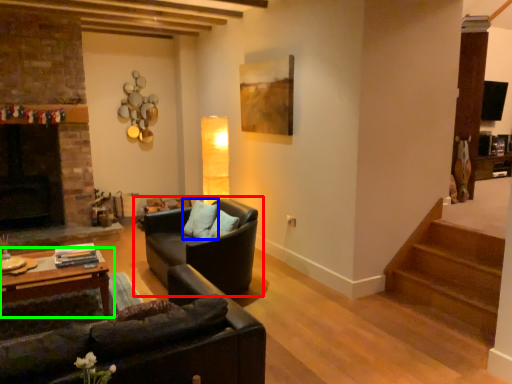
Question: Based on their relative distances, which object is nearer to studio couch (highlighted by a red box)? Choose from pillow (highlighted by a blue box) and table (highlighted by a green box).

Choices:
 (A) pillow
 (B) table

Answer: (A)